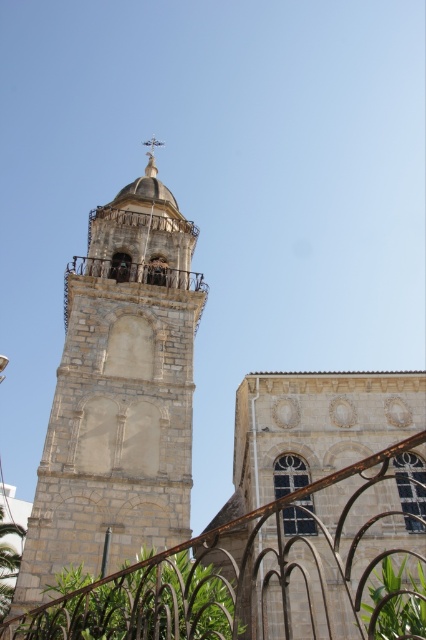
Is rusty metal fence at lower left further to camera compared to white stone spire at upper center?

No, rusty metal fence at lower left is in front of white stone spire at upper center.

Can you confirm if rusty metal fence at lower left is bigger than white stone spire at upper center?

Yes.

Consider the image. Who is more distant from viewer, (112, 605) or (154, 163)?

The point (154, 163) is more distant.

Find the location of `rusty metal fence at lower left`. rusty metal fence at lower left is located at coordinates (270, 572).

Who is lower down, beige stone tower at center or rusty metal fence at lower left?

rusty metal fence at lower left

Where is `beige stone tower at center`? beige stone tower at center is located at coordinates (118, 396).

This screenshot has width=426, height=640. What do you see at coordinates (118, 396) in the screenshot?
I see `beige stone tower at center` at bounding box center [118, 396].

Who is shorter, beige stone tower at center or white stone spire at upper center?

white stone spire at upper center

The width and height of the screenshot is (426, 640). Find the location of `beige stone tower at center`. beige stone tower at center is located at coordinates (118, 396).